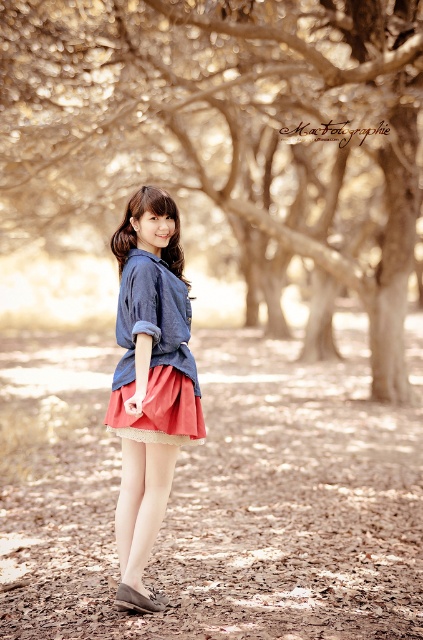
You are a photographer trying to capture a photo of the matte denim shirt at center. However, the brown textured tree at center is blocking your view. Can you move to the left or right to avoid the tree while still keeping both objects in frame?

The brown textured tree at center is located above the matte denim shirt at center, so moving to the left or right might allow you to position yourself where the tree branches do not obstruct the view of the shirt while keeping both objects in frame.